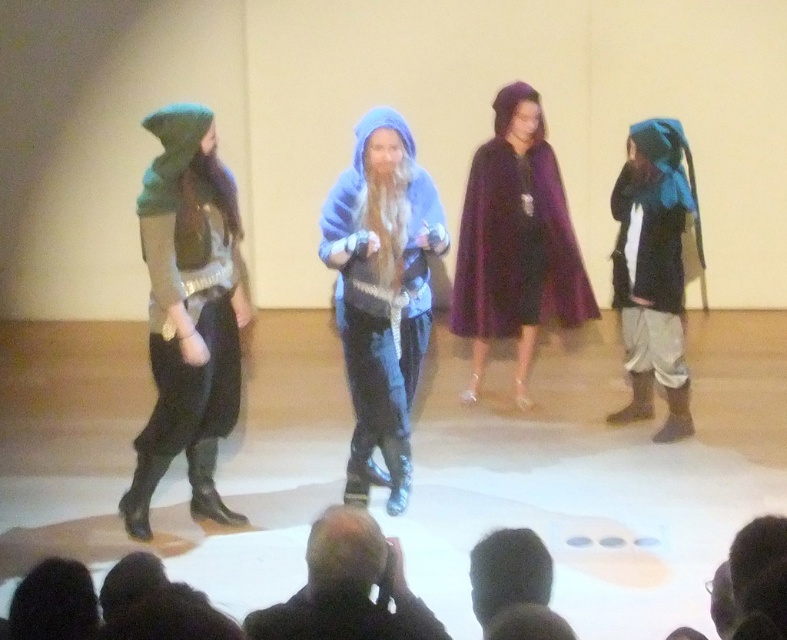
Is blue felt hood at right thinner than black leather jacket at lower center?

Yes, blue felt hood at right is thinner than black leather jacket at lower center.

Who is more distant from viewer, (652, 339) or (324, 524)?

Positioned behind is point (652, 339).

Who is more distant from viewer, [682,385] or [305,556]?

Positioned behind is point [682,385].

I want to click on blue felt hood at right, so click(652, 269).

Between point (483, 573) and point (13, 604), which one is positioned behind?

Positioned behind is point (483, 573).

This screenshot has height=640, width=787. I want to click on black hair at lower center, so click(508, 572).

Locate an element on the screen. black hair at lower center is located at coordinates (508, 572).

Can you confirm if green fuzzy hood at left is positioned to the left of black hair at lower left?

Yes, green fuzzy hood at left is to the left of black hair at lower left.

Who is positioned more to the right, green fuzzy hood at left or black hair at lower left?

black hair at lower left

I want to click on green fuzzy hood at left, so click(187, 312).

Locate an element on the screen. This screenshot has width=787, height=640. green fuzzy hood at left is located at coordinates pyautogui.click(x=187, y=312).